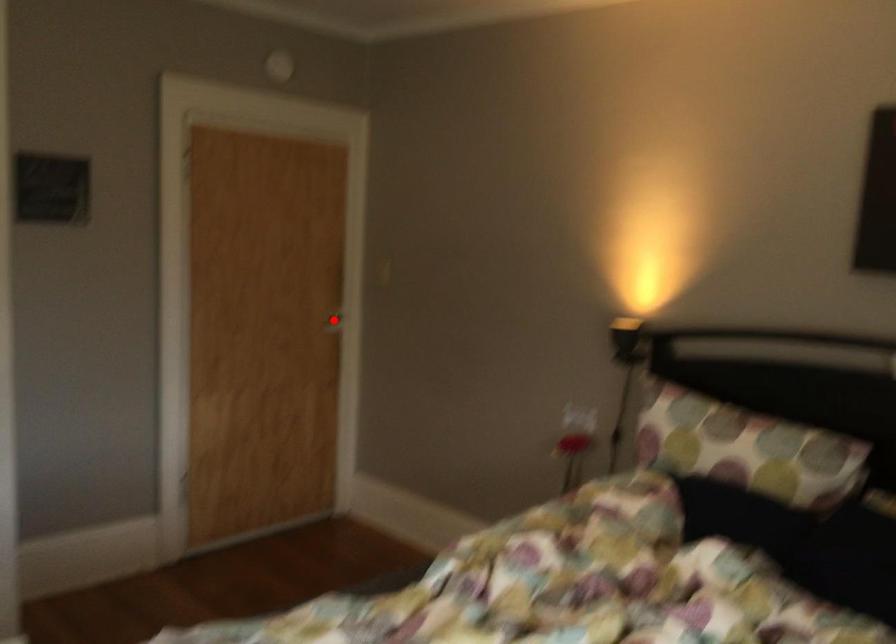
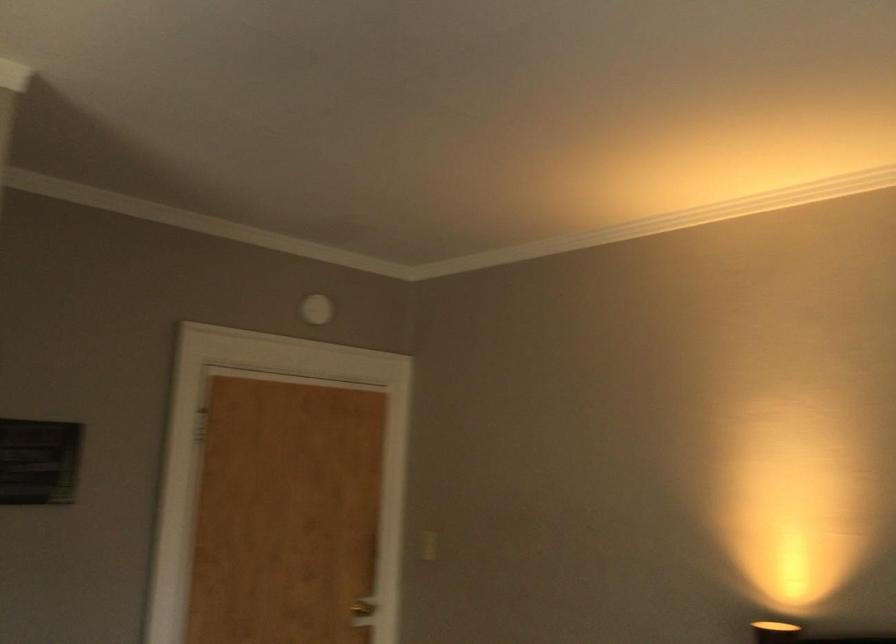
Find the pixel in the second image that matches the highlighted location in the first image.

(362, 612)